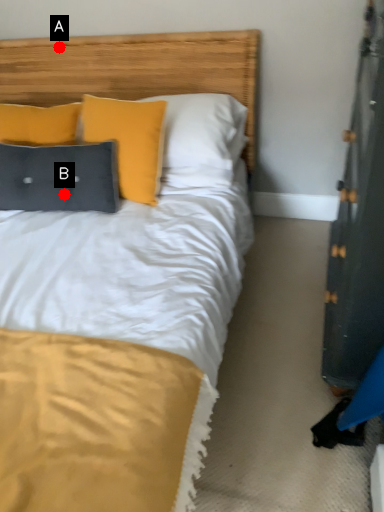
Question: Two points are circled on the image, labeled by A and B beside each circle. Which point is closer to the camera?

Choices:
 (A) A is closer
 (B) B is closer

Answer: (B)